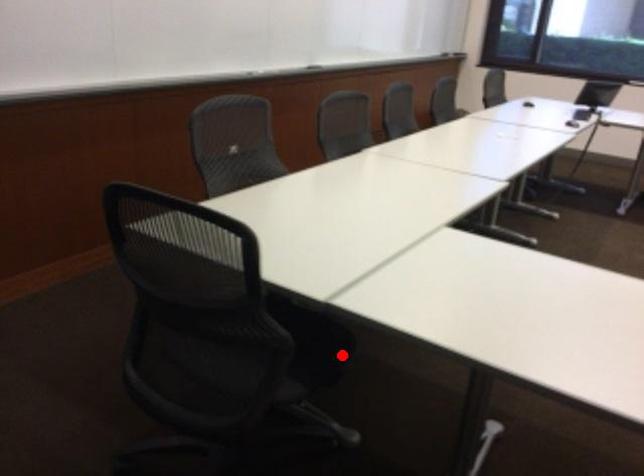
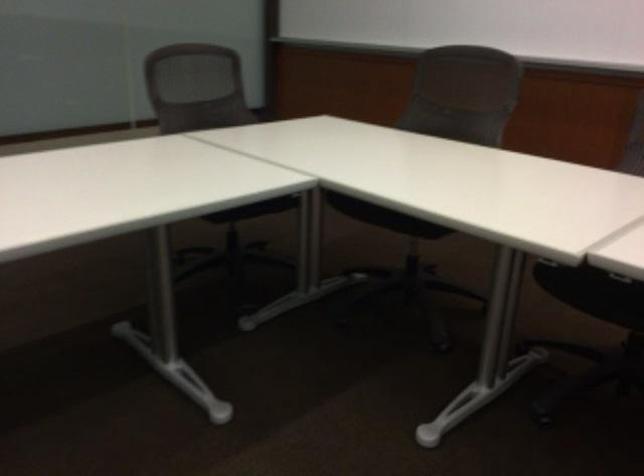
The point at the highlighted location is marked in the first image. Where is the corresponding point in the second image?

(254, 209)